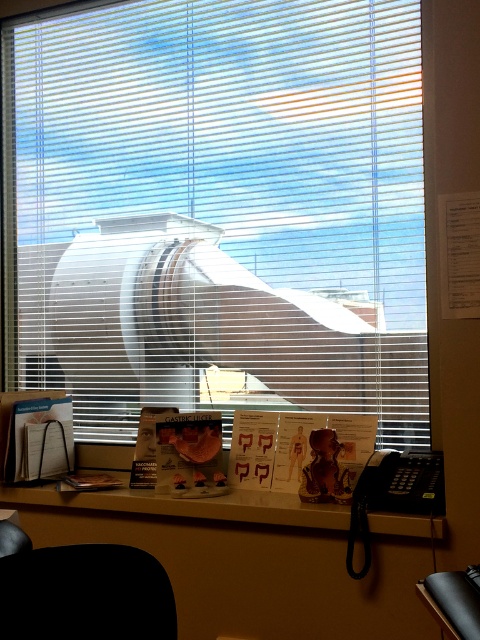
You are an interior designer planning to install a new desk in the office. You have a desk that is 2 meters wide. The current desk, the white glossy desk at lower center, is narrower than the white plastic blinds at upper center. Can the new desk fit in the same space as the existing one if the width of the blinds is 2.5 meters?

The white plastic blinds at upper center are wider than the white glossy desk at lower center, and since the blinds are 2.5 meters wide, the existing desk is narrower than 2.5 meters. The new desk is 2 meters wide, which is also narrower than 2.5 meters. Therefore, the new desk can fit in the same space as the existing one.